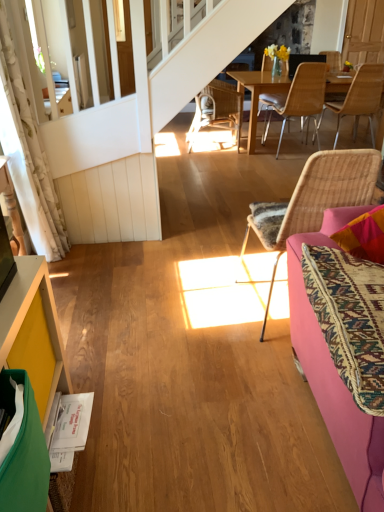
Question: Can you confirm if yellow painted wood cabinet at lower left is thinner than pink fabric couch at right?

Choices:
 (A) no
 (B) yes

Answer: (B)

Question: Can you confirm if yellow painted wood cabinet at lower left is wider than pink fabric couch at right?

Choices:
 (A) yes
 (B) no

Answer: (B)

Question: Does yellow painted wood cabinet at lower left have a smaller size compared to pink fabric couch at right?

Choices:
 (A) no
 (B) yes

Answer: (B)

Question: Is yellow painted wood cabinet at lower left with pink fabric couch at right?

Choices:
 (A) yes
 (B) no

Answer: (B)

Question: Would you say yellow painted wood cabinet at lower left is a long distance from pink fabric couch at right?

Choices:
 (A) no
 (B) yes

Answer: (A)

Question: Is point (11, 50) positioned closer to the camera than point (238, 123)?

Choices:
 (A) closer
 (B) farther

Answer: (A)

Question: Would you say white floral fabric curtain at left is inside or outside woven rattan chair at center, the fourth chair when ordered from front to back?

Choices:
 (A) outside
 (B) inside

Answer: (A)

Question: From a real-world perspective, is white floral fabric curtain at left above or below woven rattan chair at center, the fourth chair when ordered from front to back?

Choices:
 (A) below
 (B) above

Answer: (B)

Question: Is white floral fabric curtain at left bigger or smaller than woven rattan chair at center, the 1th chair viewed from the left?

Choices:
 (A) big
 (B) small

Answer: (B)

Question: Does point (359, 68) appear closer or farther from the camera than point (34, 300)?

Choices:
 (A) closer
 (B) farther

Answer: (B)

Question: Choose the correct answer: Is light brown wicker chair at upper right, which ranks as the fourth chair in left-to-right order, inside yellow painted wood cabinet at lower left or outside it?

Choices:
 (A) inside
 (B) outside

Answer: (B)

Question: In terms of height, does light brown wicker chair at upper right, which appears as the first chair when viewed from the right, look taller or shorter compared to yellow painted wood cabinet at lower left?

Choices:
 (A) tall
 (B) short

Answer: (A)

Question: From the image's perspective, is light brown wicker chair at upper right, which appears as the first chair when viewed from the right, above or below yellow painted wood cabinet at lower left?

Choices:
 (A) above
 (B) below

Answer: (A)

Question: From their relative heights in the image, would you say white floral fabric curtain at left is taller or shorter than pink fabric couch at right?

Choices:
 (A) tall
 (B) short

Answer: (A)

Question: From a real-world perspective, is white floral fabric curtain at left positioned above or below pink fabric couch at right?

Choices:
 (A) above
 (B) below

Answer: (A)